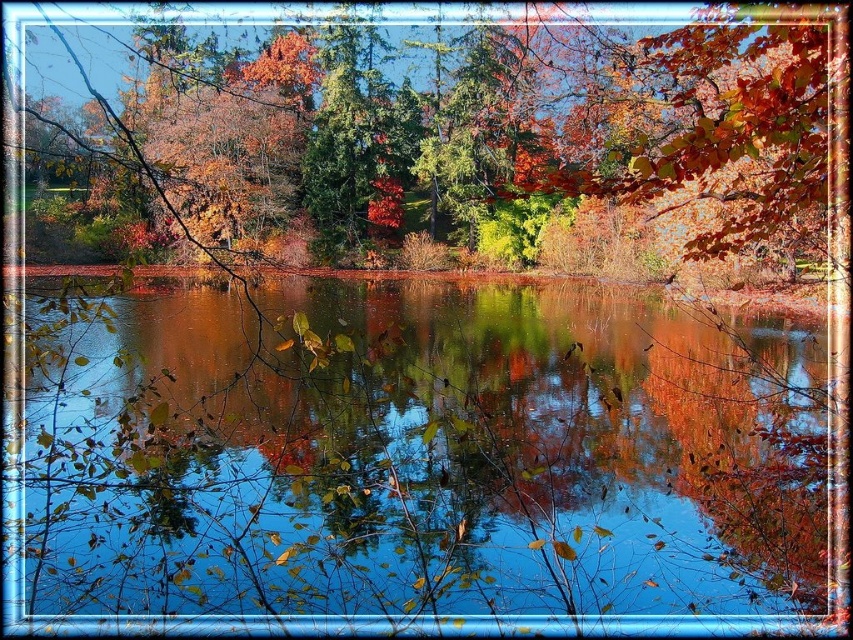
Looking at this image, you are an artist trying to paint the scene. You notice the transparent water at center and autumn leaves at center. Which object takes up more space horizontally in the image?

The autumn leaves at center take up more horizontal space because the transparent water at center has a lesser width compared to autumn leaves at center.

You are an artist trying to capture the autumn scene. You notice the transparent water at center and autumn leaves at center. Which object in your view is smaller in size?

The transparent water at center is smaller than autumn leaves at center, so the transparent water at center is the smaller object.

You are standing at the edge of the lake and notice two points marked on the image. The first point is at coordinates point (315, 545) and the second is at point (656, 106). Which point is closer to you as you stand at the edge?

Point (315, 545) is in front of point (656, 106), so it is closer to you as you stand at the edge of the lake.